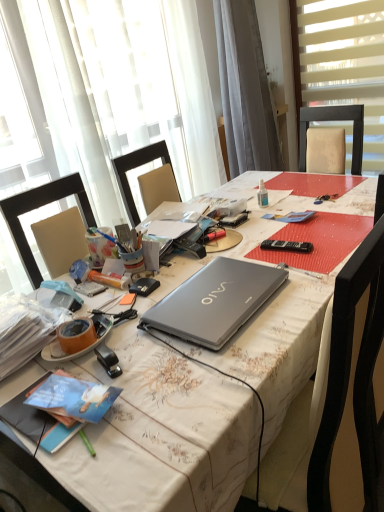
This screenshot has width=384, height=512. Find the location of `vacant area that is situated to the right of blue matte book at lower left, which is counted as the 2th book, starting from the top`. vacant area that is situated to the right of blue matte book at lower left, which is counted as the 2th book, starting from the top is located at coordinates (139, 396).